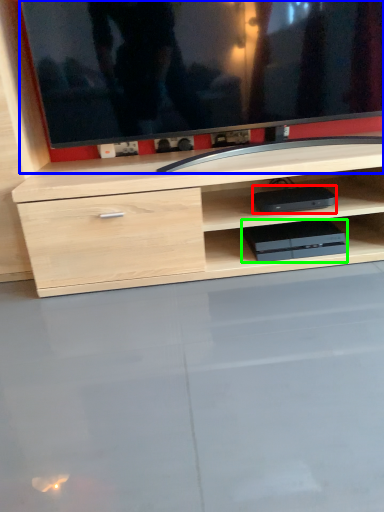
Question: Estimate the real-world distances between objects in this image. Which object is farther from equipment (highlighted by a red box), television (highlighted by a blue box) or equipment (highlighted by a green box)?

Choices:
 (A) television
 (B) equipment

Answer: (A)